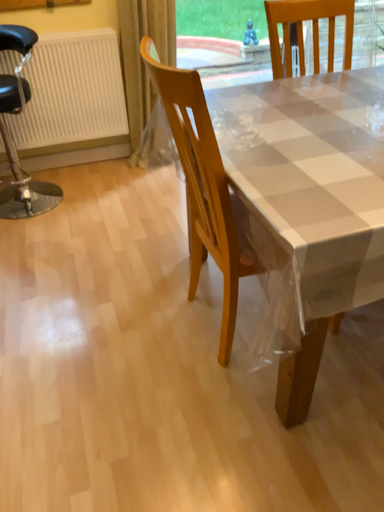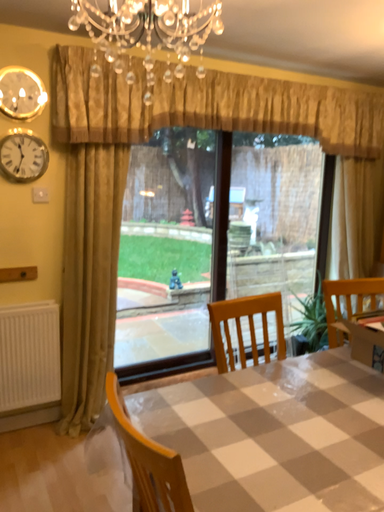
Question: How did the camera likely rotate when shooting the video?

Choices:
 (A) rotated left
 (B) rotated right

Answer: (B)